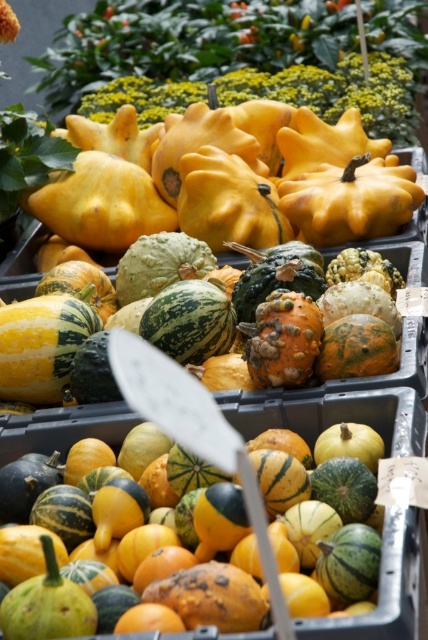
Question: Is speckled orange squash at center behind speckled green squash at center?

Choices:
 (A) yes
 (B) no

Answer: (B)

Question: Among these points, which one is farthest from the camera?

Choices:
 (A) (327, 253)
 (B) (246, 614)

Answer: (A)

Question: Is speckled orange squash at center below speckled green squash at center?

Choices:
 (A) yes
 (B) no

Answer: (A)

Question: Does speckled orange squash at center have a greater width compared to speckled green squash at center?

Choices:
 (A) yes
 (B) no

Answer: (A)

Question: Which object appears closest to the camera in this image?

Choices:
 (A) speckled orange squash at center
 (B) speckled green squash at center

Answer: (A)